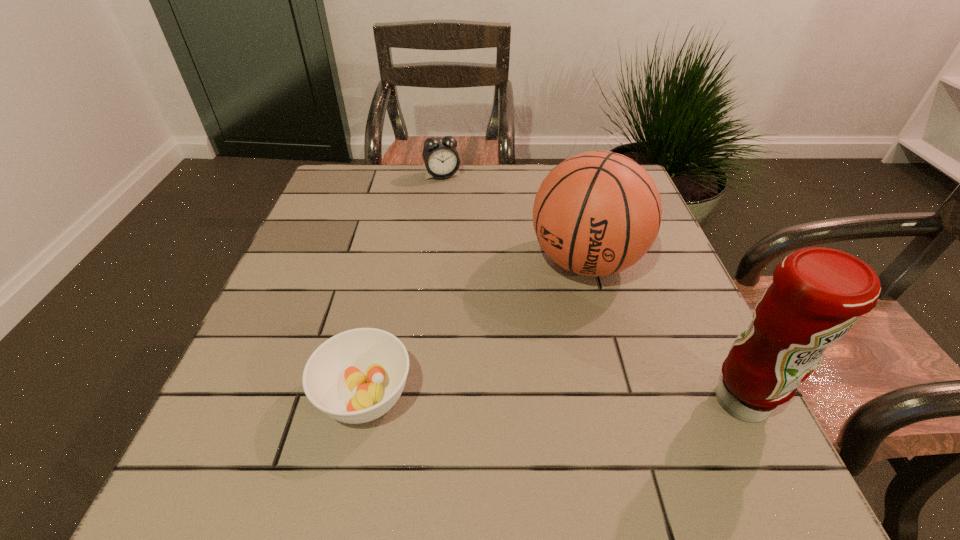
Locate an element on the screen. The width and height of the screenshot is (960, 540). object present at the near left corner is located at coordinates (356, 376).

Locate an element on the screen. The height and width of the screenshot is (540, 960). object at the near right corner is located at coordinates (817, 294).

In the image, there is a desktop. Where is `vacant space at the far edge`? vacant space at the far edge is located at coordinates (527, 177).

I want to click on vacant space at the near edge of the desktop, so click(461, 387).

Identify the location of vacant point at the left edge. (332, 218).

Locate an element on the screen. This screenshot has width=960, height=540. vacant space at the right edge of the desktop is located at coordinates (665, 340).

In the image, there is a desktop. Where is `vacant space at the far left corner`? This screenshot has width=960, height=540. vacant space at the far left corner is located at coordinates (348, 202).

The width and height of the screenshot is (960, 540). I want to click on vacant position at the near right corner of the desktop, so click(x=654, y=401).

You are a GUI agent. You are given a task and a screenshot of the screen. Output one action in this format:
    pyautogui.click(x=<x>, y=<y>)
    Task: Click on the vacant region between the shortest object and the second farthest object
    The height and width of the screenshot is (540, 960).
    Given the screenshot: What is the action you would take?
    pyautogui.click(x=475, y=328)

This screenshot has height=540, width=960. I want to click on vacant space that is in between the soup bowl and the alarm clock, so click(404, 286).